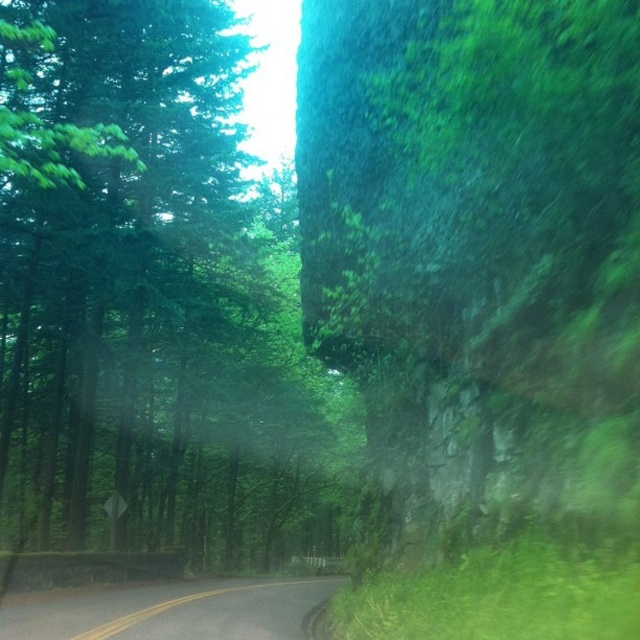
Question: Which point appears closest to the camera in this image?

Choices:
 (A) (93, 228)
 (B) (333, 580)

Answer: (A)

Question: Which object appears farthest from the camera in this image?

Choices:
 (A) black asphalt road at lower center
 (B) green leafy tree at center

Answer: (B)

Question: Is green leafy tree at center smaller than black asphalt road at lower center?

Choices:
 (A) yes
 (B) no

Answer: (B)

Question: Does green leafy tree at center have a smaller size compared to black asphalt road at lower center?

Choices:
 (A) no
 (B) yes

Answer: (A)

Question: Does green leafy tree at center appear on the left side of black asphalt road at lower center?

Choices:
 (A) yes
 (B) no

Answer: (A)

Question: Among these objects, which one is farthest from the camera?

Choices:
 (A) green leafy tree at center
 (B) black asphalt road at lower center

Answer: (A)